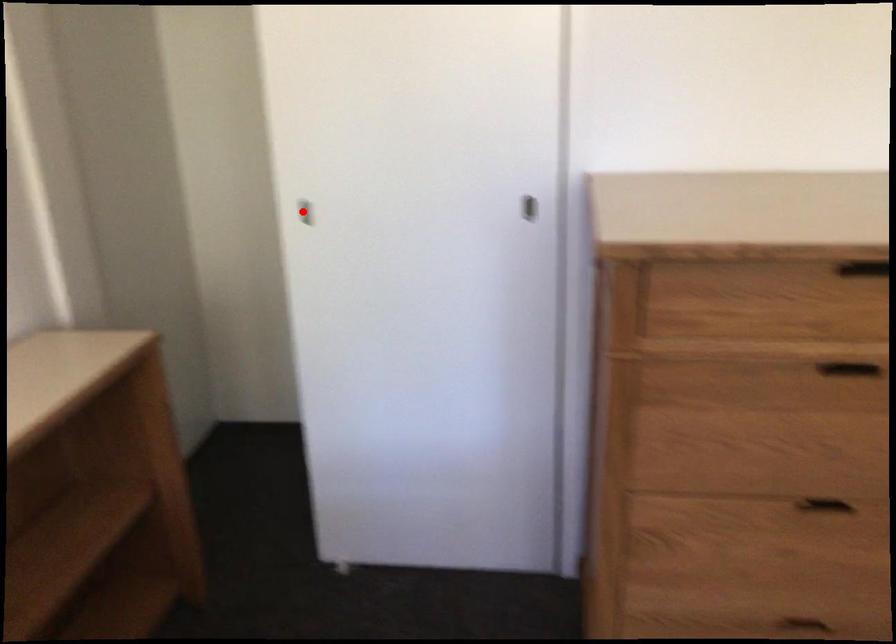
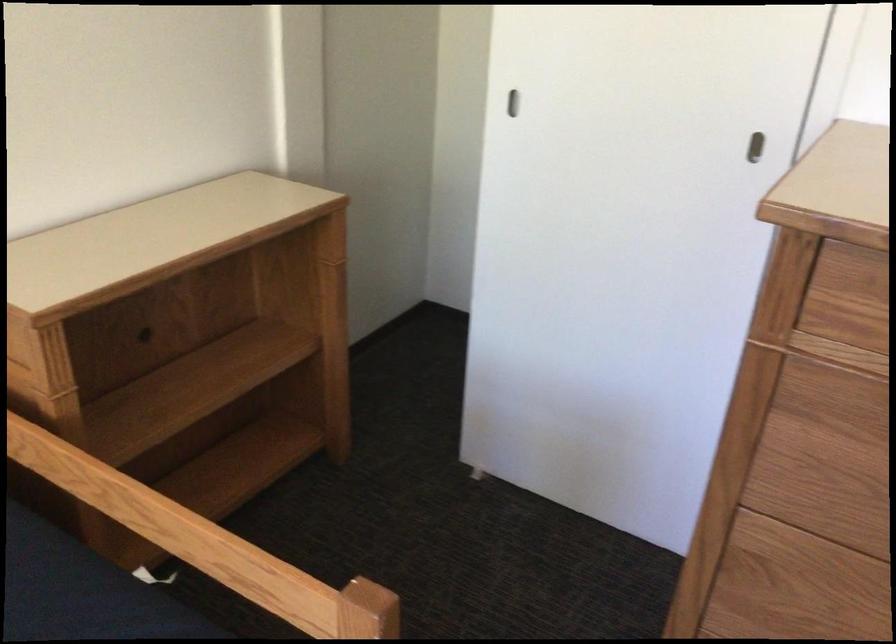
In the second image, find the point that corresponds to the highlighted location in the first image.

(512, 102)